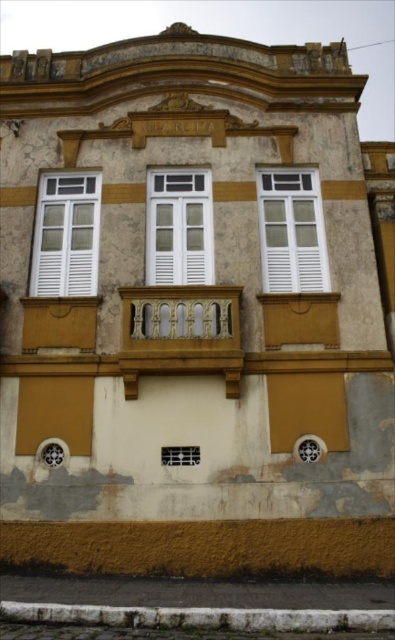
You are standing in front of the building and want to determine the spatial relationship between two points marked on its facade. The first point is at coordinate point (310, 240) and the second is at point (334, 442). Which point is closer to the viewer?

Point (334, 442) is closer to the viewer because point (310, 240) is behind it.

You are an architect assessing the building facade. You need to determine which of the two items, the white matte window at center or the matte white shutter at center, requires more vertical space for repair. Based on their sizes, which one should you prioritize?

The white matte window at center is taller than the matte white shutter at center, so it requires more vertical space for repair and should be prioritized.

You are an architect evaluating the building facade. You notice the white matte window at left and the white matte window at center. Which window would require more glass to replace if you were to replace both?

The white matte window at center requires more glass since it is larger than the white matte window at left.